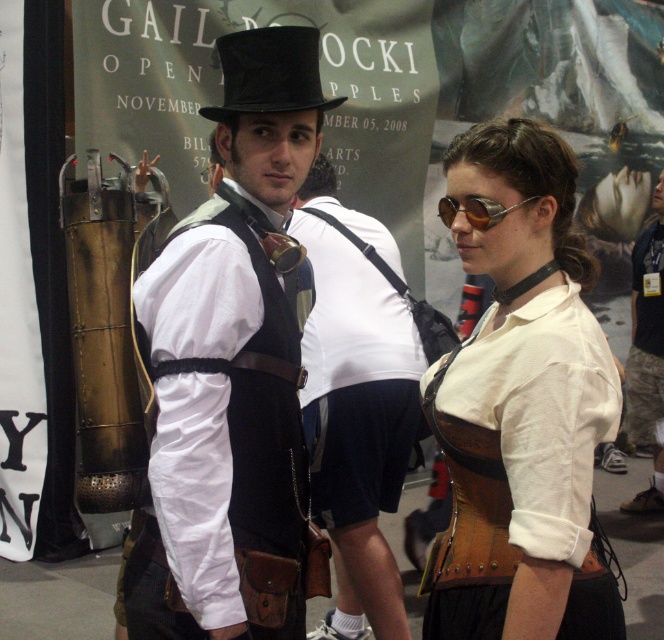
Question: Where is matte black vest at center located in relation to black felt top hat at upper center in the image?

Choices:
 (A) below
 (B) above

Answer: (A)

Question: Which point is closer to the camera?

Choices:
 (A) white leather vest at center
 (B) black felt top hat at upper center
 (C) matte white shirt at center

Answer: (C)

Question: Which point is closer to the camera taking this photo?

Choices:
 (A) (347, 401)
 (B) (339, 99)

Answer: (B)

Question: Can you confirm if matte white shirt at center is positioned to the right of gold metallic goggles at center?

Choices:
 (A) no
 (B) yes

Answer: (B)

Question: Which point is closer to the camera?

Choices:
 (A) (473, 417)
 (B) (438, 212)
 (C) (404, 381)

Answer: (A)

Question: Is white leather vest at center in front of brushed metal tank at center?

Choices:
 (A) yes
 (B) no

Answer: (A)